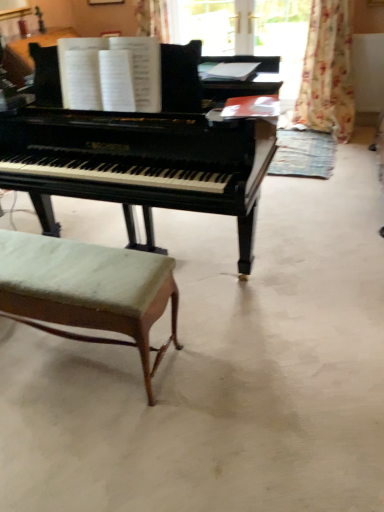
Question: Should I look upward or downward to see floral fabric curtain at upper right?

Choices:
 (A) down
 (B) up

Answer: (B)

Question: Does black polished piano at center have a smaller size compared to black piano at center?

Choices:
 (A) yes
 (B) no

Answer: (B)

Question: Is black polished piano at center thinner than black piano at center?

Choices:
 (A) no
 (B) yes

Answer: (B)

Question: Is black polished piano at center oriented away from black piano at center?

Choices:
 (A) yes
 (B) no

Answer: (B)

Question: Considering the relative sizes of black polished piano at center and black piano at center in the image provided, is black polished piano at center bigger than black piano at center?

Choices:
 (A) yes
 (B) no

Answer: (A)

Question: Is black polished piano at center surrounding black piano at center?

Choices:
 (A) yes
 (B) no

Answer: (B)

Question: Considering the relative positions of black polished piano at center and black piano at center in the image provided, is black polished piano at center in front of black piano at center?

Choices:
 (A) yes
 (B) no

Answer: (B)

Question: Considering the relative sizes of black piano at center and green fabric stool at lower left in the image provided, is black piano at center taller than green fabric stool at lower left?

Choices:
 (A) yes
 (B) no

Answer: (B)

Question: From a real-world perspective, is black piano at center under green fabric stool at lower left?

Choices:
 (A) no
 (B) yes

Answer: (B)

Question: From the image's perspective, does black piano at center appear lower than green fabric stool at lower left?

Choices:
 (A) no
 (B) yes

Answer: (A)

Question: Is the depth of black piano at center less than that of green fabric stool at lower left?

Choices:
 (A) no
 (B) yes

Answer: (B)

Question: From a real-world perspective, is black piano at center on green fabric stool at lower left?

Choices:
 (A) yes
 (B) no

Answer: (B)

Question: Does black piano at center turn towards green fabric stool at lower left?

Choices:
 (A) yes
 (B) no

Answer: (B)

Question: Is green fabric stool at lower left to the left of floral fabric curtain at upper right from the viewer's perspective?

Choices:
 (A) yes
 (B) no

Answer: (A)